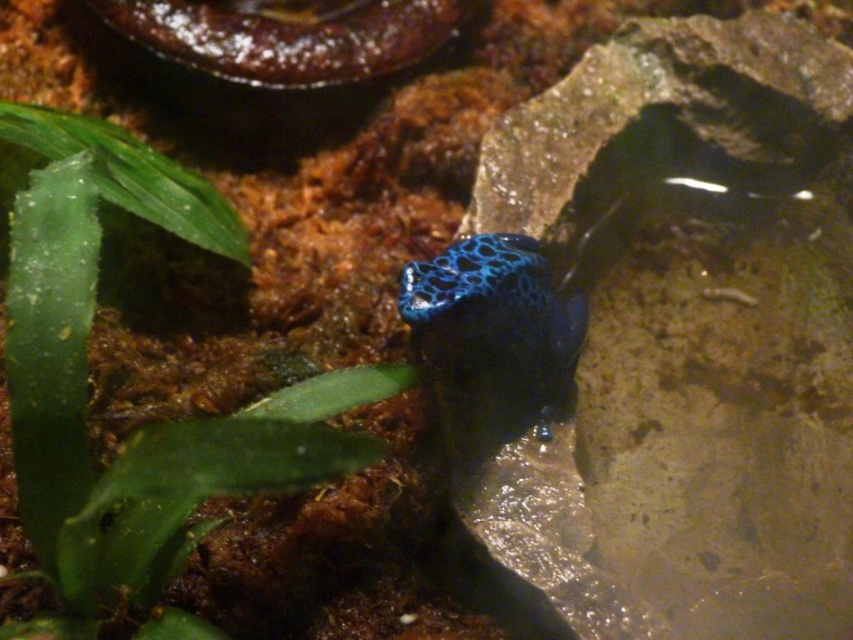
You are a photographer aiming to capture the blue glossy frog at center and the green leafy plant at upper left in a single frame. Based on their sizes, which object would appear wider in the photo?

The green leafy plant at upper left would appear wider in the photo since its width surpasses that of the blue glossy frog at center.

You are a researcher observing a frog in a terrarium. You notice a point marked at coordinates (86, 380). Based on the frog and the terrarium setup, what object is located at that point?

The point at coordinates (86, 380) indicates a green leafy plant at upper left.